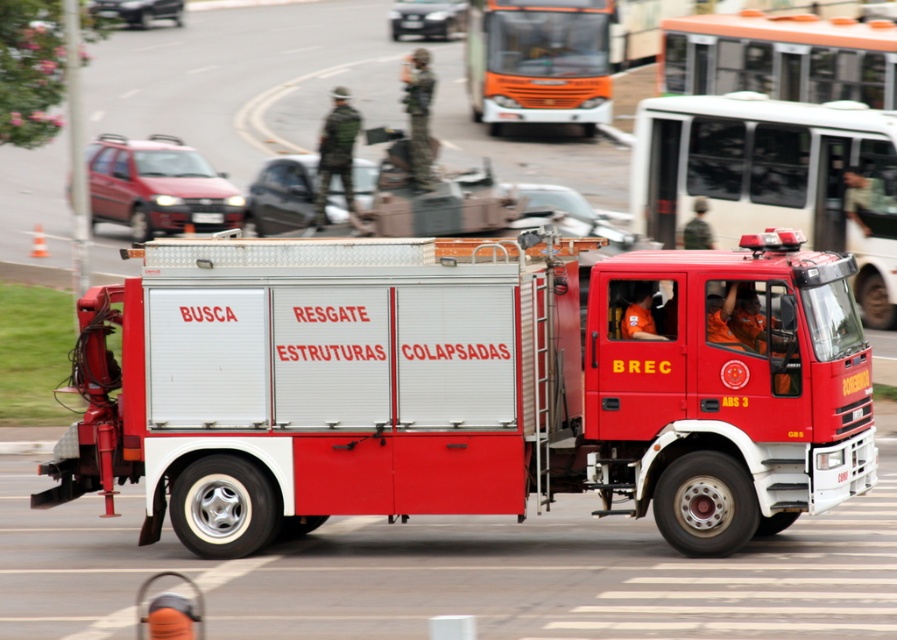
Question: Is white matte bus at upper center wider than matte red car at left?

Choices:
 (A) no
 (B) yes

Answer: (A)

Question: Among these objects, which one is nearest to the camera?

Choices:
 (A) black plastic license plate at center
 (B) metallic silver bus at upper center
 (C) metallic red car at center

Answer: (B)

Question: Among these points, which one is farthest from the camera?

Choices:
 (A) (364, 208)
 (B) (737, 13)

Answer: (B)

Question: Does metallic red fire truck at center appear on the left side of matte red car at left?

Choices:
 (A) no
 (B) yes

Answer: (A)

Question: Which of the following is the farthest from the observer?

Choices:
 (A) (515, 10)
 (B) (806, 44)
 (C) (421, 1)

Answer: (C)

Question: Is white matte bus at upper center below metallic gray car at center?

Choices:
 (A) yes
 (B) no

Answer: (A)